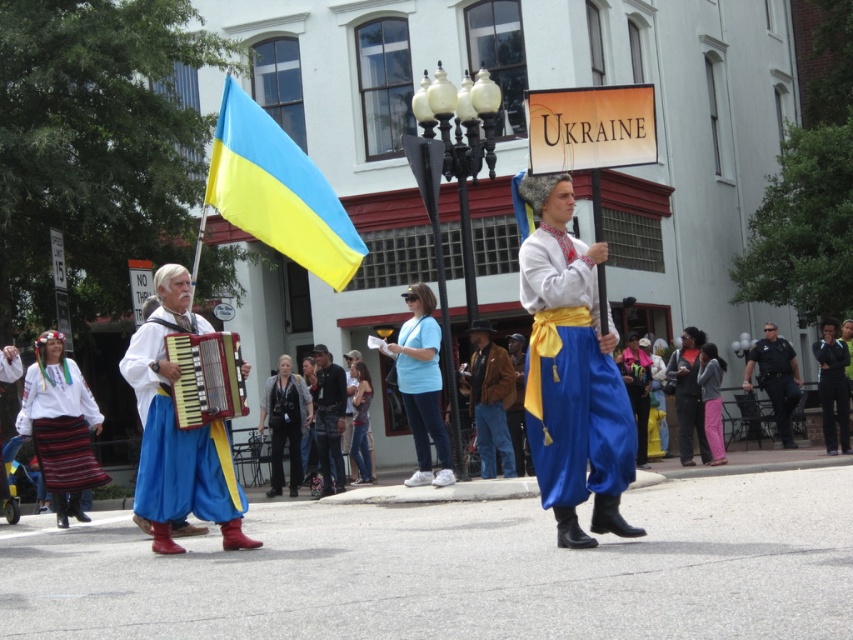
You are a photographer standing in the crowd at the Ukrainian festival. You want to take a picture of the wooden accordion at center and denim jacket at center. Which object is closer to the camera?

The wooden accordion at center is closer to the camera because it is positioned over the denim jacket at center.

You are a photographer trying to capture the entire scene of the cultural parade. You notice the wooden accordion at center and denim jeans at center. Which object should you focus on to ensure it fits entirely within your camera frame if the frame can only accommodate the smaller of the two?

The wooden accordion at center occupies less space than the denim jeans at center, so you should focus on the wooden accordion at center to ensure it fits entirely within the camera frame.

You are a photographer positioned at the center of the street. You want to capture both the person holding the red accordion and the flag carrier with the Ukrainian flag in your photo. The person with the red accordion is at point (252,138) and the flag carrier is at point (183,388). Since you can only focus on one point at a time, which point should you focus on to ensure both subjects are in the frame?

You should focus on point (183,388) because point (252,138) is in front of point (183,388). By focusing on the further point, both subjects will be within the frame.